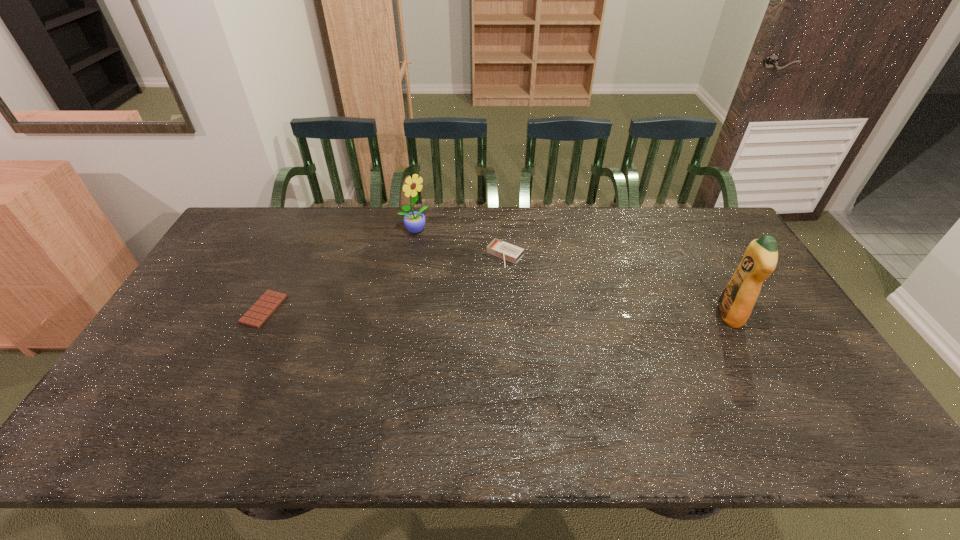
Where is `free space on the desktop that is between the shortest object and the detergent and is positioned on the striking surface of the third object from left to right`? free space on the desktop that is between the shortest object and the detergent and is positioned on the striking surface of the third object from left to right is located at coordinates (454, 312).

You are a GUI agent. You are given a task and a screenshot of the screen. Output one action in this format:
    pyautogui.click(x=<x>, y=<y>)
    Task: Click on the vacant spot on the desktop that is between the leftmost object and the tallest object and is positioned on the front-facing side of the second tallest object
    
    Given the screenshot: What is the action you would take?
    pyautogui.click(x=529, y=313)